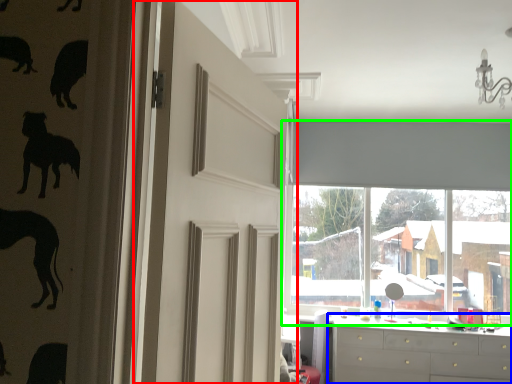
Question: Which object is positioned farthest from door (highlighted by a red box)? Select from chest of drawers (highlighted by a blue box) and window (highlighted by a green box).

Choices:
 (A) chest of drawers
 (B) window

Answer: (B)